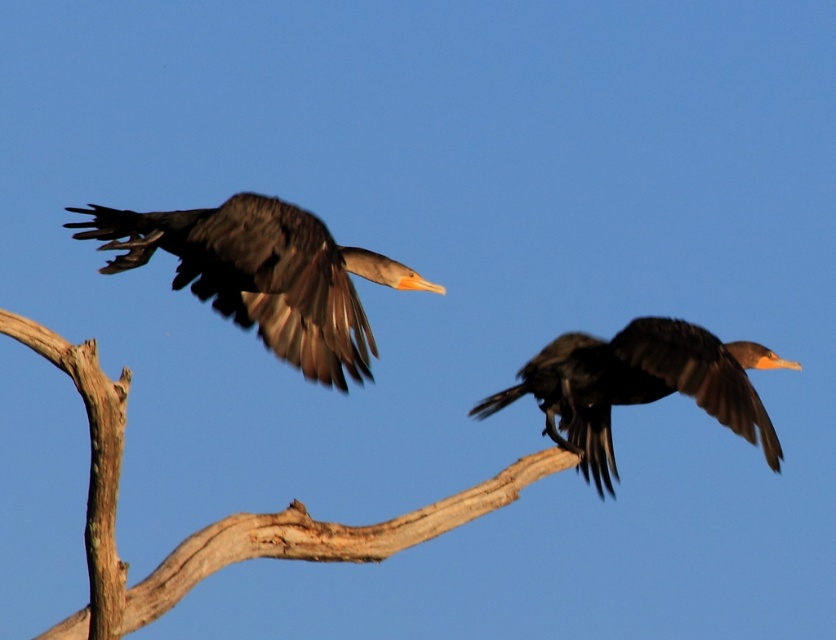
You are a photographer trying to capture a closeup of the shiny black bird at center. You notice the smooth wood branch at center is blocking part of the bird. Can you determine if the branch is wider than the bird?

The smooth wood branch at center is wider than the shiny black bird at center, so yes, the branch is wider and may block part of the bird.

You are a photographer trying to focus on two points in the image. The first point is point (245,547) and the second point is point (161,218). Which point should you adjust your camera focus to if you want to capture the closer one?

Point (245,547) is closer to the camera than point (161,218), so you should focus on point (245,547) to capture the closer one.